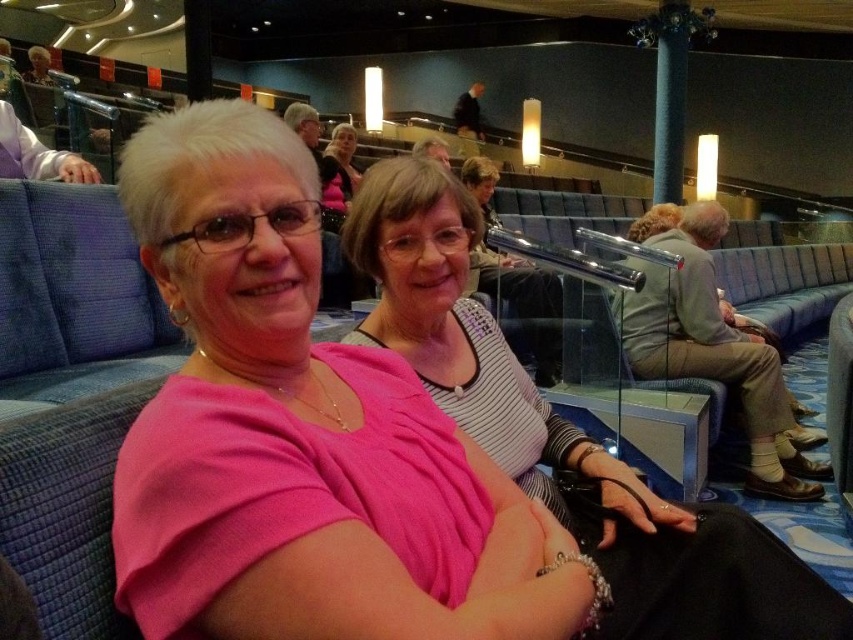
Question: Can you confirm if pink fabric shirt at center is thinner than matte black shirt at center?

Choices:
 (A) yes
 (B) no

Answer: (B)

Question: Which object is farther from the camera taking this photo?

Choices:
 (A) pink fabric shirt at center
 (B) matte black shirt at center

Answer: (B)

Question: Estimate the real-world distances between objects in this image. Which object is farther from the pink fabric shirt at center?

Choices:
 (A) striped fabric shirt at center
 (B) matte black shirt at center

Answer: (B)

Question: Observing the image, what is the correct spatial positioning of pink fabric shirt at center in reference to striped fabric shirt at center?

Choices:
 (A) above
 (B) below

Answer: (B)

Question: Estimate the real-world distances between objects in this image. Which object is farther from the striped fabric shirt at center?

Choices:
 (A) pink fabric shirt at center
 (B) matte black shirt at center

Answer: (B)

Question: Is striped fabric shirt at center to the right of matte black shirt at center from the viewer's perspective?

Choices:
 (A) yes
 (B) no

Answer: (A)